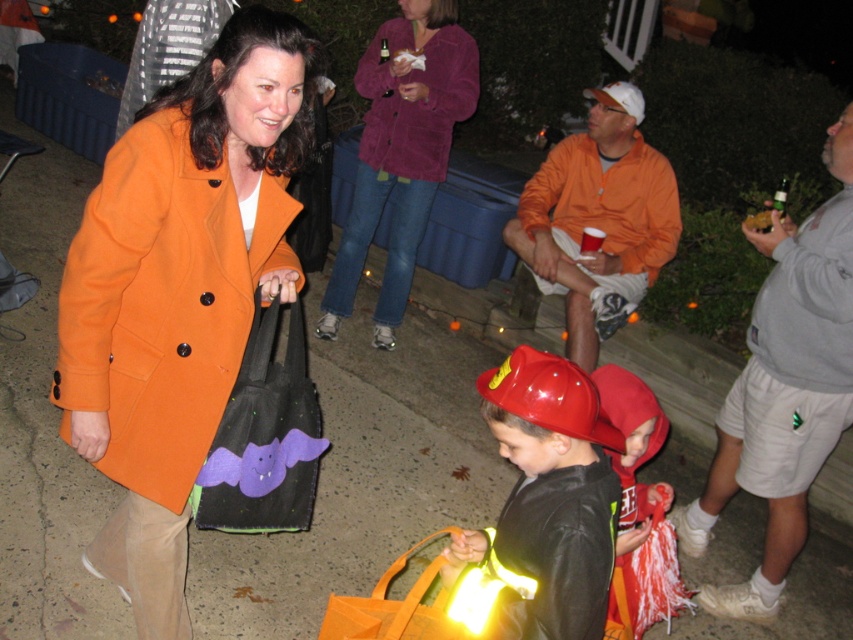
Does black felt bag with bat design at center appear on the left side of velvet purple coat at center?

Correct, you'll find black felt bag with bat design at center to the left of velvet purple coat at center.

Does black felt bag with bat design at center have a lesser width compared to velvet purple coat at center?

Yes.

Describe the element at coordinates (264, 436) in the screenshot. Image resolution: width=853 pixels, height=640 pixels. I see `black felt bag with bat design at center` at that location.

The width and height of the screenshot is (853, 640). I want to click on black felt bag with bat design at center, so click(264, 436).

Who is positioned more to the left, reflective plastic fire helmet at center or red matte fire helmet at center?

Positioned to the left is reflective plastic fire helmet at center.

The height and width of the screenshot is (640, 853). What do you see at coordinates (549, 496) in the screenshot?
I see `reflective plastic fire helmet at center` at bounding box center [549, 496].

Between point (582, 563) and point (664, 508), which one is positioned behind?

The point (664, 508) is behind.

This screenshot has width=853, height=640. Identify the location of reflective plastic fire helmet at center. (549, 496).

Does point (563, 564) lie behind point (387, 177)?

No, it is not.

Identify the location of reflective plastic fire helmet at center. This screenshot has width=853, height=640. (549, 496).